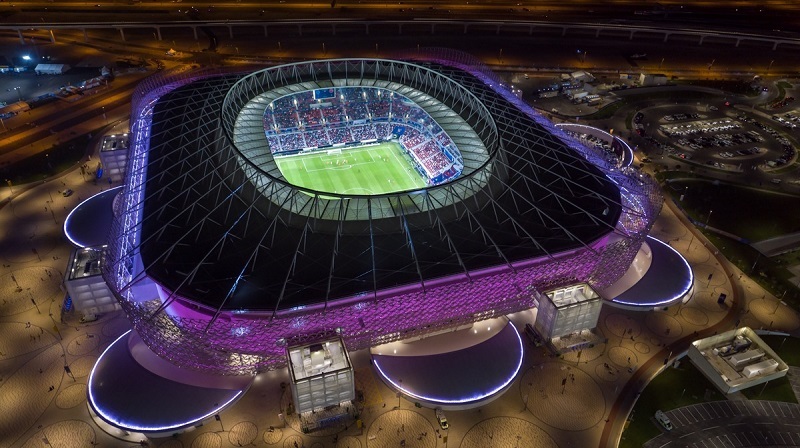
At what (x,y) coordinates should I click in order to perform the action: click on cover. Please return your answer as a coordinate pair (x, y). The height and width of the screenshot is (448, 800). Looking at the image, I should click on (462, 369).